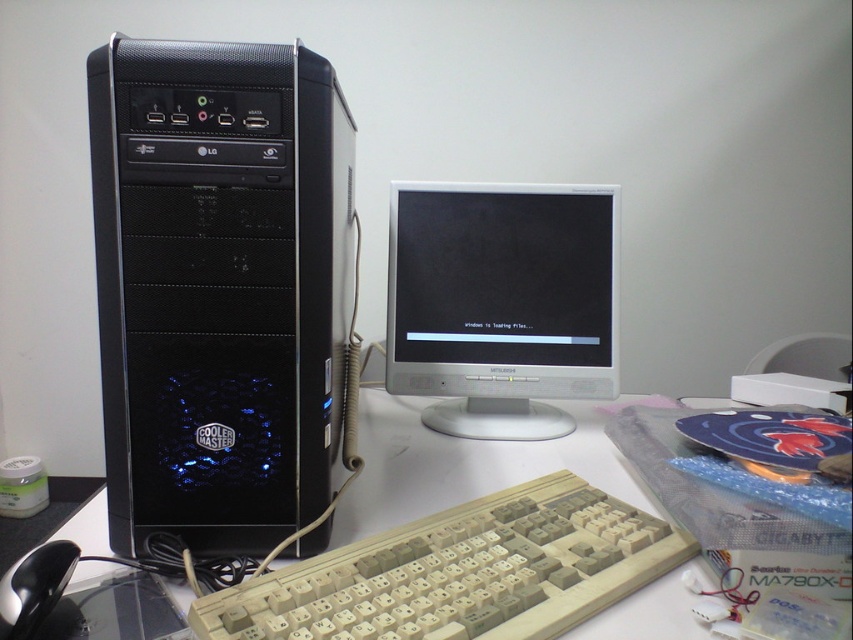
Question: Which point is farther to the camera?

Choices:
 (A) (352, 582)
 (B) (611, 500)
 (C) (236, 486)
 (D) (490, 435)

Answer: (D)

Question: Which object is the farthest from the beige plastic keyboard at lower center?

Choices:
 (A) white glossy monitor at center
 (B) black matte tower at left
 (C) black plastic mouse at lower left

Answer: (A)

Question: Which object is positioned closest to the beige plastic keyboard at lower center?

Choices:
 (A) black plastic mouse at lower left
 (B) white glossy monitor at center
 (C) black matte tower at left

Answer: (C)

Question: Is black matte tower at left thinner than beige plastic keyboard at lower center?

Choices:
 (A) no
 (B) yes

Answer: (B)

Question: Can you confirm if black matte tower at left is positioned above black plastic mouse at lower left?

Choices:
 (A) yes
 (B) no

Answer: (A)

Question: Is white plastic keyboard at center to the left of black plastic mouse at lower left from the viewer's perspective?

Choices:
 (A) yes
 (B) no

Answer: (B)